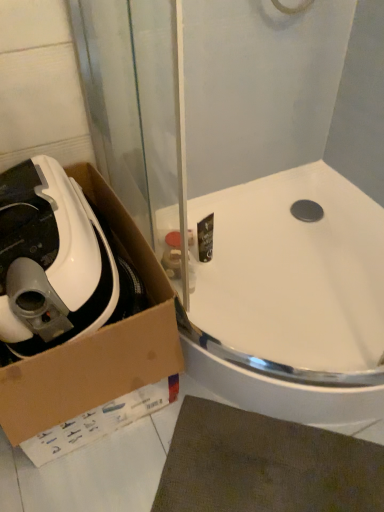
Question: Can you confirm if white matte vacuum cleaner at left is positioned to the left of white glossy sink at upper center?

Choices:
 (A) no
 (B) yes

Answer: (B)

Question: Considering the relative sizes of white matte vacuum cleaner at left and white glossy sink at upper center in the image provided, is white matte vacuum cleaner at left shorter than white glossy sink at upper center?

Choices:
 (A) no
 (B) yes

Answer: (A)

Question: Is white matte vacuum cleaner at left positioned behind white glossy sink at upper center?

Choices:
 (A) yes
 (B) no

Answer: (B)

Question: Can you confirm if white matte vacuum cleaner at left is positioned to the right of white glossy sink at upper center?

Choices:
 (A) no
 (B) yes

Answer: (A)

Question: Can you confirm if white matte vacuum cleaner at left is bigger than white glossy sink at upper center?

Choices:
 (A) no
 (B) yes

Answer: (A)

Question: Looking at their shapes, would you say white matte vacuum cleaner at left is wider or thinner than cardboard box at lower left?

Choices:
 (A) thin
 (B) wide

Answer: (A)

Question: From the image's perspective, is white matte vacuum cleaner at left above or below cardboard box at lower left?

Choices:
 (A) above
 (B) below

Answer: (A)

Question: Considering the positions of white matte vacuum cleaner at left and cardboard box at lower left in the image, is white matte vacuum cleaner at left taller or shorter than cardboard box at lower left?

Choices:
 (A) short
 (B) tall

Answer: (A)

Question: Choose the correct answer: Is white matte vacuum cleaner at left inside cardboard box at lower left or outside it?

Choices:
 (A) outside
 (B) inside

Answer: (B)

Question: Is white glossy sink at upper center taller or shorter than cardboard box at lower left?

Choices:
 (A) tall
 (B) short

Answer: (B)

Question: Is white glossy sink at upper center inside or outside of cardboard box at lower left?

Choices:
 (A) outside
 (B) inside

Answer: (A)

Question: From a real-world perspective, relative to cardboard box at lower left, is white glossy sink at upper center vertically above or below?

Choices:
 (A) below
 (B) above

Answer: (A)

Question: Considering the positions of point click(292, 222) and point click(132, 360), is point click(292, 222) closer or farther from the camera than point click(132, 360)?

Choices:
 (A) farther
 (B) closer

Answer: (A)

Question: From their relative heights in the image, would you say cardboard box at lower left is taller or shorter than white matte vacuum cleaner at left?

Choices:
 (A) tall
 (B) short

Answer: (A)

Question: In terms of width, does cardboard box at lower left look wider or thinner when compared to white matte vacuum cleaner at left?

Choices:
 (A) thin
 (B) wide

Answer: (B)